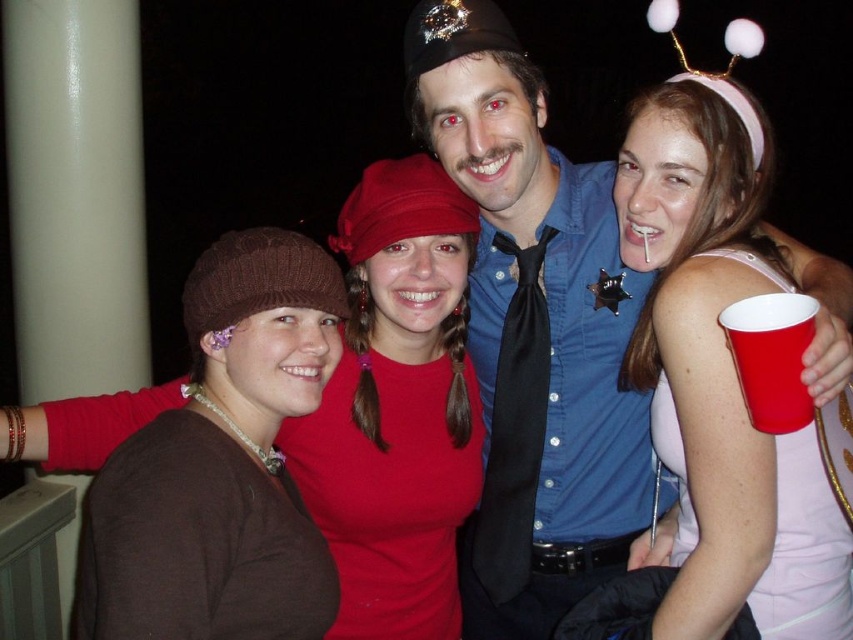
Question: Which of the following is the closest to the observer?

Choices:
 (A) pink satin dress at center
 (B) blue shirt at center

Answer: (A)

Question: Which of the following is the farthest from the observer?

Choices:
 (A) blue shirt at center
 (B) pink satin dress at center
 (C) brown knit beanie at left

Answer: (C)

Question: Can you confirm if blue shirt at center is positioned to the left of pink satin dress at center?

Choices:
 (A) no
 (B) yes

Answer: (B)

Question: Does blue shirt at center appear over pink satin dress at center?

Choices:
 (A) no
 (B) yes

Answer: (A)

Question: Which point is farther to the camera?

Choices:
 (A) blue shirt at center
 (B) pink satin dress at center
 (C) brown knit beanie at left

Answer: (C)

Question: Is blue shirt at center positioned behind pink satin dress at center?

Choices:
 (A) yes
 (B) no

Answer: (A)